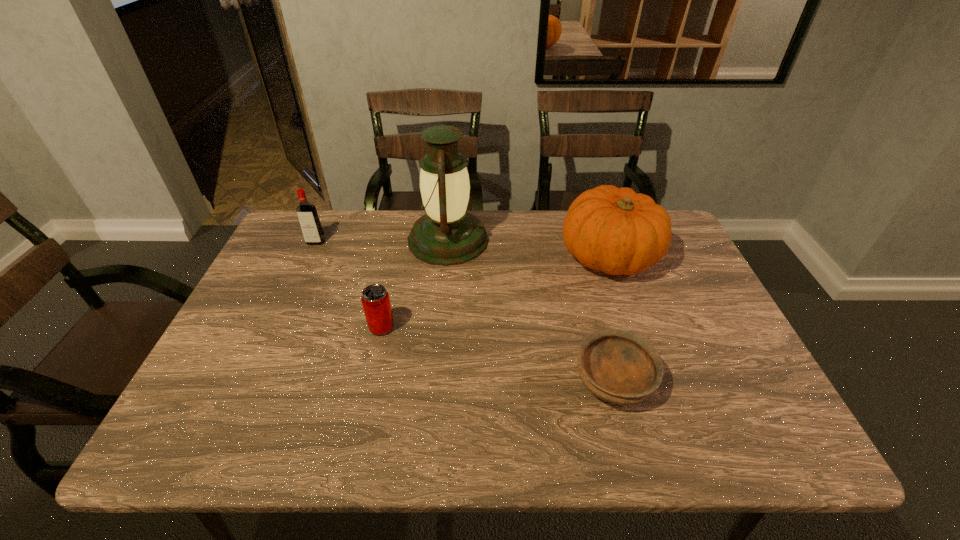
You are a GUI agent. You are given a task and a screenshot of the screen. Output one action in this format:
    pyautogui.click(x=<x>, y=<y>)
    Task: Click on the vacant space that satisfies the following two spatial constraints: 1. with the light compartment facing forward on the tallest object; 2. on the front and back of the vodka
    
    Given the screenshot: What is the action you would take?
    pyautogui.click(x=447, y=242)

Identify the location of free location that satisfies the following two spatial constraints: 1. on the front and back of the leftmost object; 2. on the left side of the bowl. This screenshot has height=540, width=960. (253, 381).

Locate an element on the screen. Image resolution: width=960 pixels, height=540 pixels. free space that satisfies the following two spatial constraints: 1. with the light compartment facing forward on the lantern; 2. on the front and back of the vodka is located at coordinates (447, 242).

This screenshot has height=540, width=960. I want to click on vacant area in the image that satisfies the following two spatial constraints: 1. on the back side of the pumpkin; 2. on the left side of the nearest object, so click(x=581, y=256).

I want to click on vacant area that satisfies the following two spatial constraints: 1. with the light compartment facing forward on the tallest object; 2. on the front and back of the leftmost object, so (x=447, y=242).